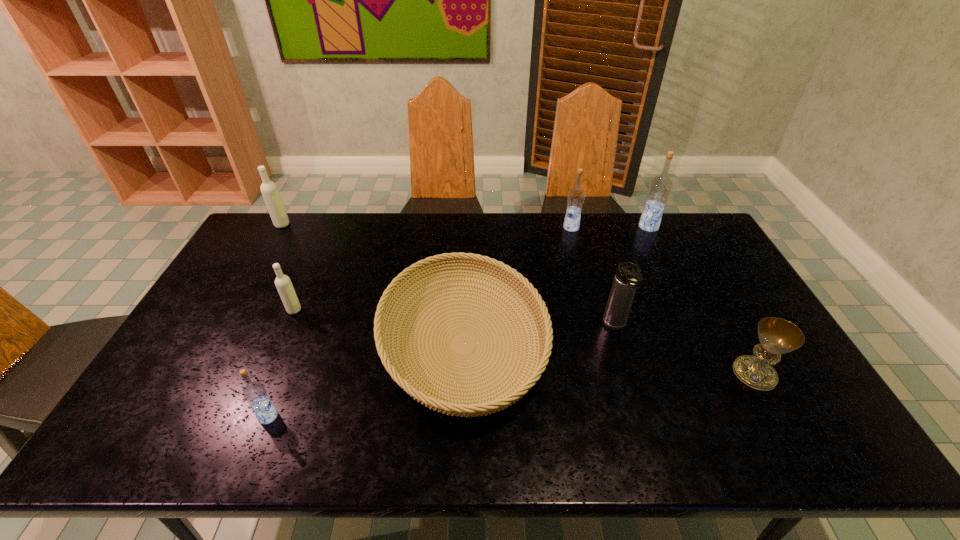
Locate which vodka is the closest to the fourth vodka from right to left. Please provide its 2D coordinates. Your answer should be formatted as a tuple, i.e. [(x, y)], where the tuple contains the x and y coordinates of a point satisfying the conditions above.

[(254, 392)]

I want to click on the second closest blue vodka relative to the thermos bottle, so 660,187.

Select which blue vodka is the closest to the second vodka from right to left. Please provide its 2D coordinates. Your answer should be formatted as a tuple, i.e. [(x, y)], where the tuple contains the x and y coordinates of a point satisfying the conditions above.

[(660, 187)]

This screenshot has width=960, height=540. I want to click on vacant area that satisfies the following two spatial constraints: 1. on the back side of the second smallest blue vodka; 2. on the right side of the basket, so click(x=468, y=228).

In order to click on vacant region that satisfies the following two spatial constraints: 1. on the handle side of the thermos bottle; 2. on the right side of the rightmost object in this screenshot , I will do `click(629, 374)`.

The width and height of the screenshot is (960, 540). Identify the location of vacant space that satisfies the following two spatial constraints: 1. on the front side of the fourth vodka from left to right; 2. on the right side of the chalice. (x=610, y=374).